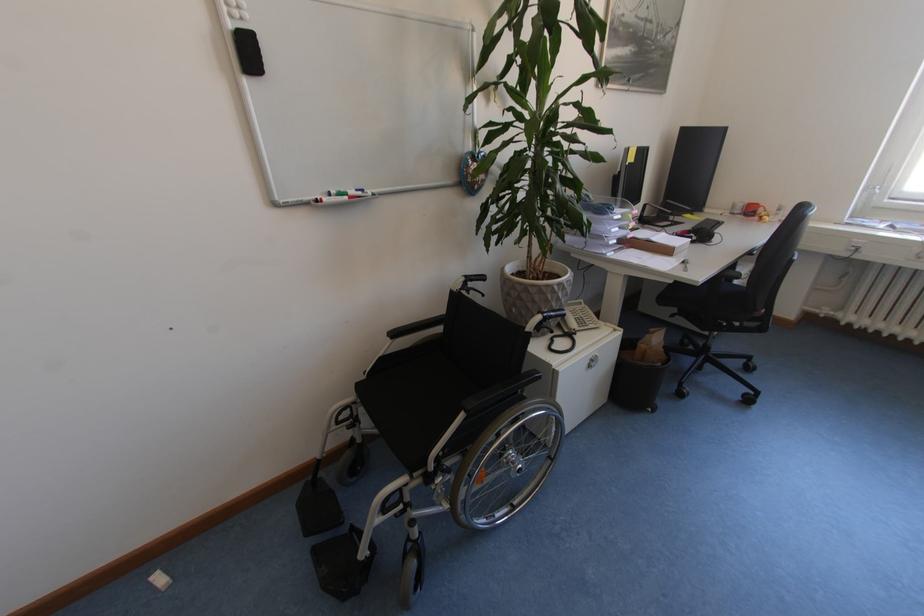
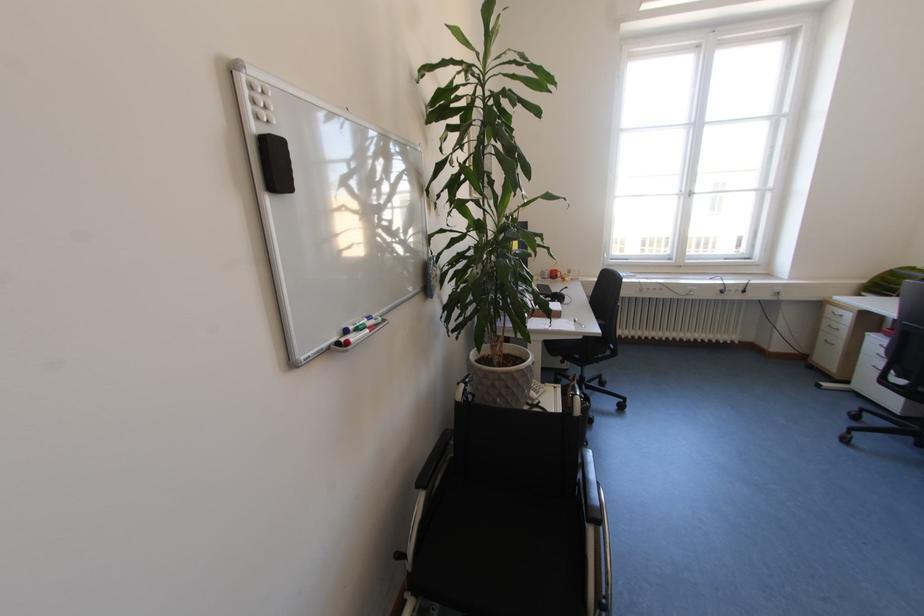
Find the pixel in the second image that matches point (744, 214) in the first image.

(553, 278)